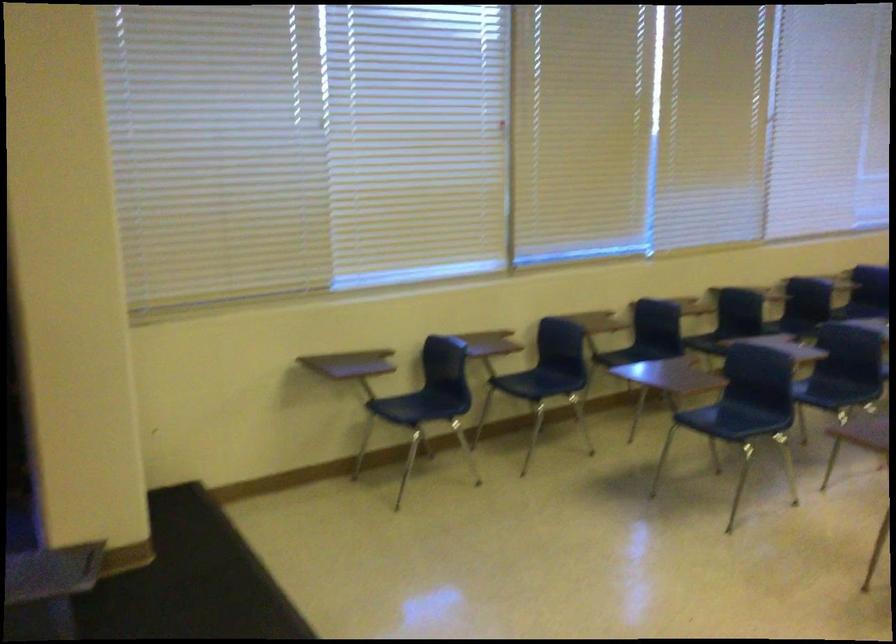
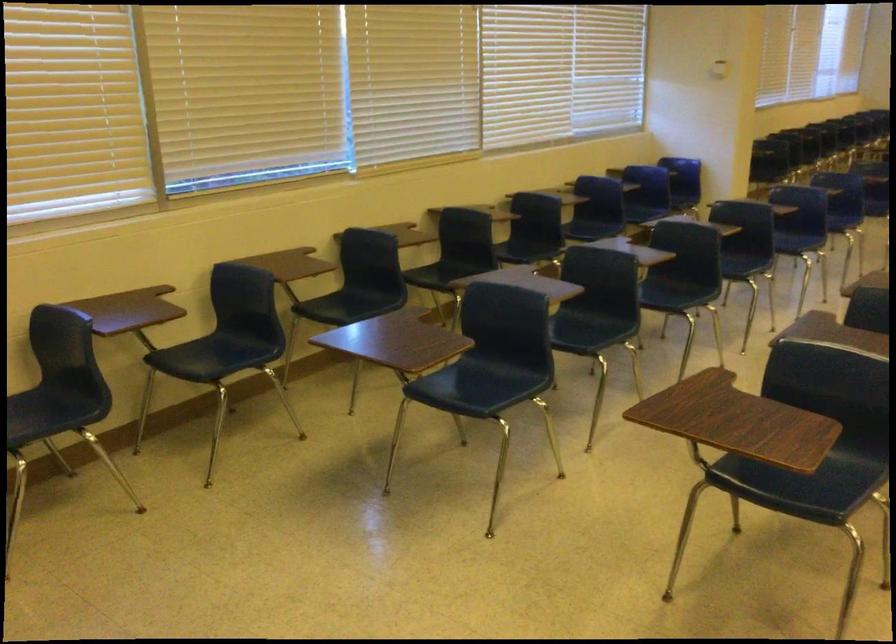
Question: The images are taken continuously from a first-person perspective. In which direction are you moving?

Choices:
 (A) Left
 (B) Right
 (C) Forward
 (D) Backward

Answer: (C)